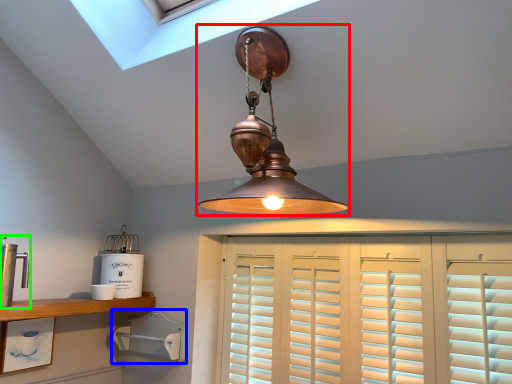
Question: Which is nearer to the lamp (highlighted by a red box)? appliance (highlighted by a blue box) or appliance (highlighted by a green box).

Choices:
 (A) appliance
 (B) appliance

Answer: (A)